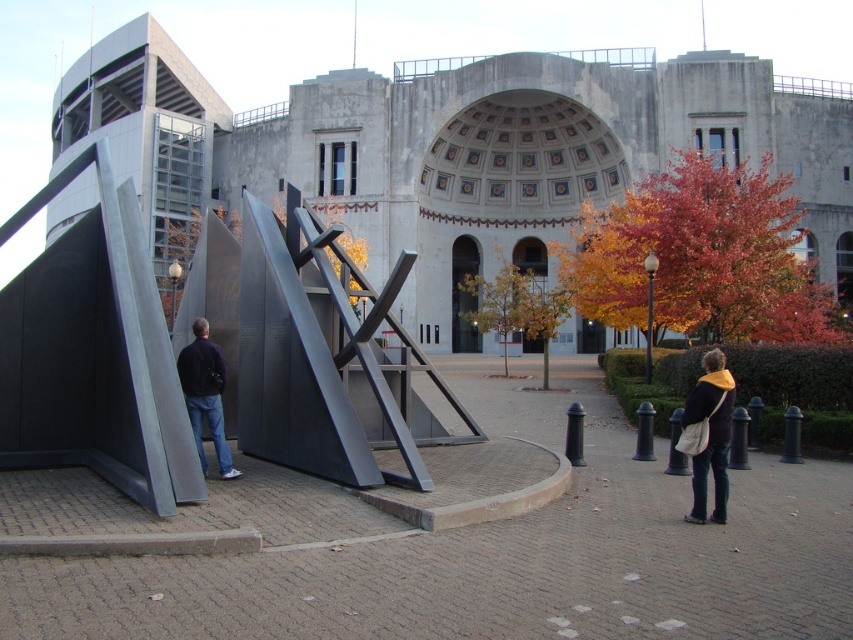
You are standing in front of the modern sculpture and see the dark blue jeans at lower right and the dark blue sweater at left. Which item is positioned more to the right side of the scene?

The dark blue jeans at lower right are positioned more to the right side of the scene than the dark blue sweater at left.

You are standing in the outdoor area and want to take a photo of the polished steel sculpture at center without including the dark blue jeans at lower right in the frame. Which direction should you move to ensure the jeans are out of the shot?

Move to the right side of the polished steel sculpture at center so that the dark blue jeans at lower right are no longer in the frame.